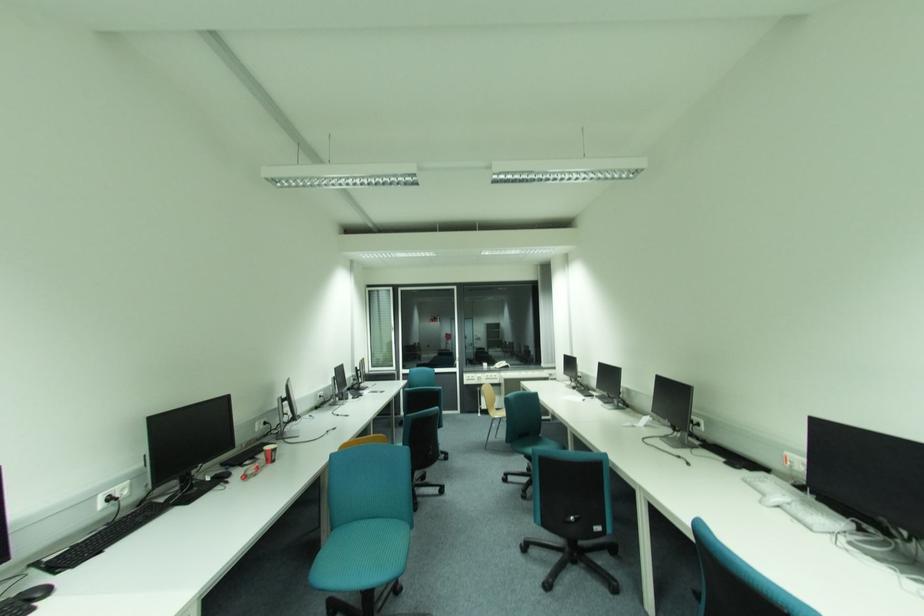
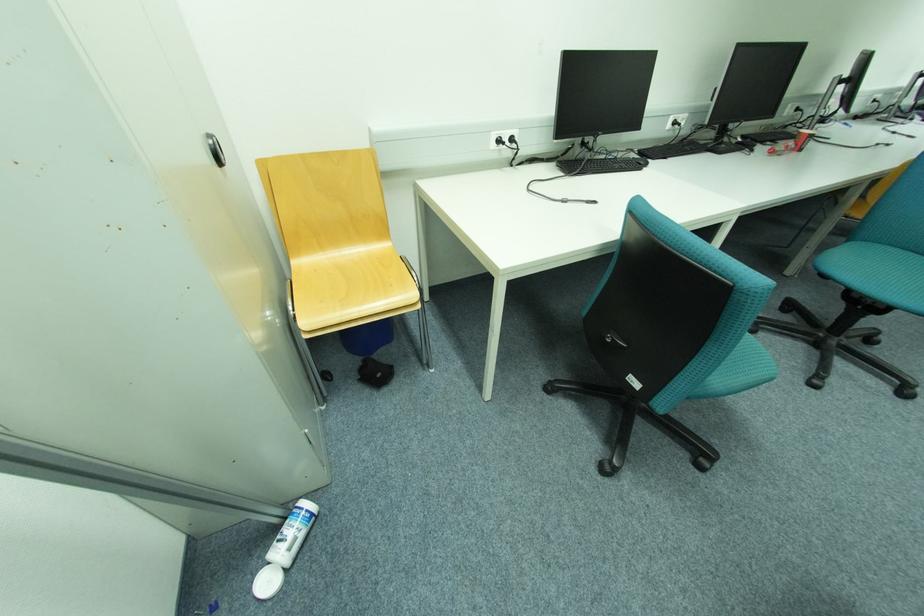
Locate, in the second image, the point that corresponds to the point at 188,488 in the first image.

(723, 140)